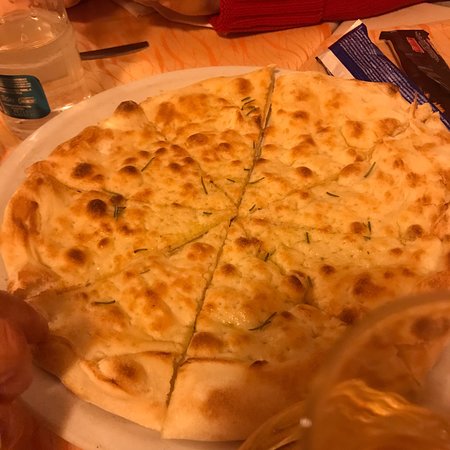
What are the coordinates of `big dish under the pizza` in the screenshot? It's located at (166, 78).